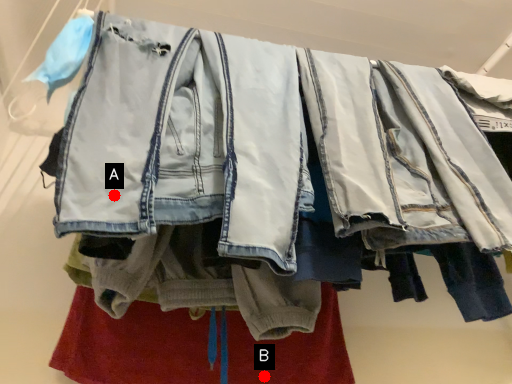
Question: Two points are circled on the image, labeled by A and B beside each circle. Which point is further to the camera?

Choices:
 (A) A is further
 (B) B is further

Answer: (B)